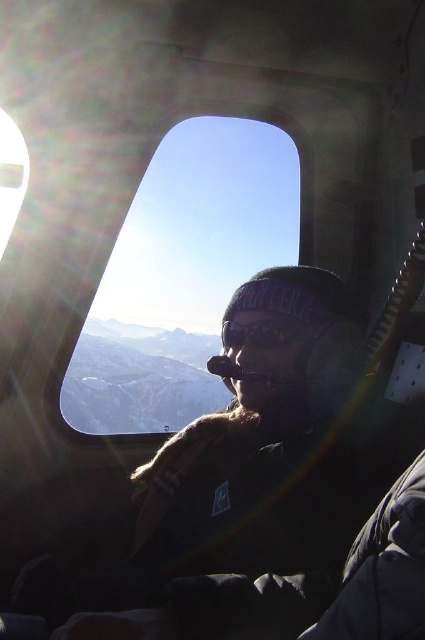
You are a passenger in the helicopter and want to take a photo of the mountain view outside the transparent glass window at center. However, there is a lens flare effect on the left side of the window. Where should you position your camera to avoid the glare?

The transparent glass window at center is located at point (x=181, y=275). To avoid the lens flare on the left side, position the camera towards the right side of the window where there is no glare.

You are inside a helicopter and want to check the weather outside. You have a 5.5 feet long weather measuring tool. Can you extend the tool fully through the transparent glass window at center without it touching the window?

The distance between the transparent glass window at center and the viewer is 5.83 feet. Since the tool is 5.5 feet long, it can be extended fully without touching the window as there is enough space.